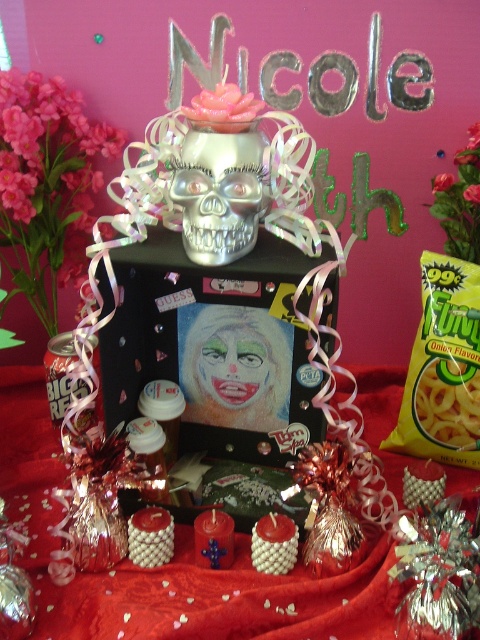
Question: Is red satin tablecloth at center closer to the viewer compared to silver metallic skull at center?

Choices:
 (A) yes
 (B) no

Answer: (A)

Question: Which point is closer to the camera?

Choices:
 (A) (203, 602)
 (B) (241, 237)

Answer: (A)

Question: Considering the relative positions of red satin tablecloth at center and silver metallic skull at center in the image provided, where is red satin tablecloth at center located with respect to silver metallic skull at center?

Choices:
 (A) right
 (B) left

Answer: (B)

Question: Which point is closer to the camera?

Choices:
 (A) red satin tablecloth at center
 (B) silver metallic skull at center

Answer: (A)

Question: Can you confirm if red satin tablecloth at center is smaller than silver metallic skull at center?

Choices:
 (A) yes
 (B) no

Answer: (B)